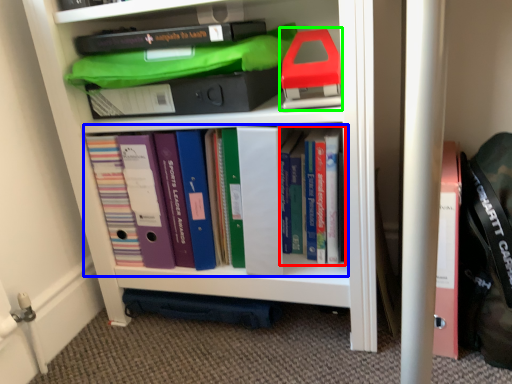
Question: Which object is the farthest from book (highlighted by a red box)? Choose among these: book (highlighted by a blue box) or book (highlighted by a green box).

Choices:
 (A) book
 (B) book

Answer: (A)